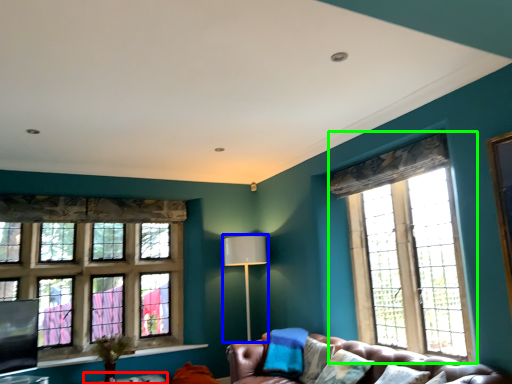
Question: Considering the real-world distances, which object is closest to table (highlighted by a red box)? lamp (highlighted by a blue box) or window (highlighted by a green box).

Choices:
 (A) lamp
 (B) window

Answer: (A)